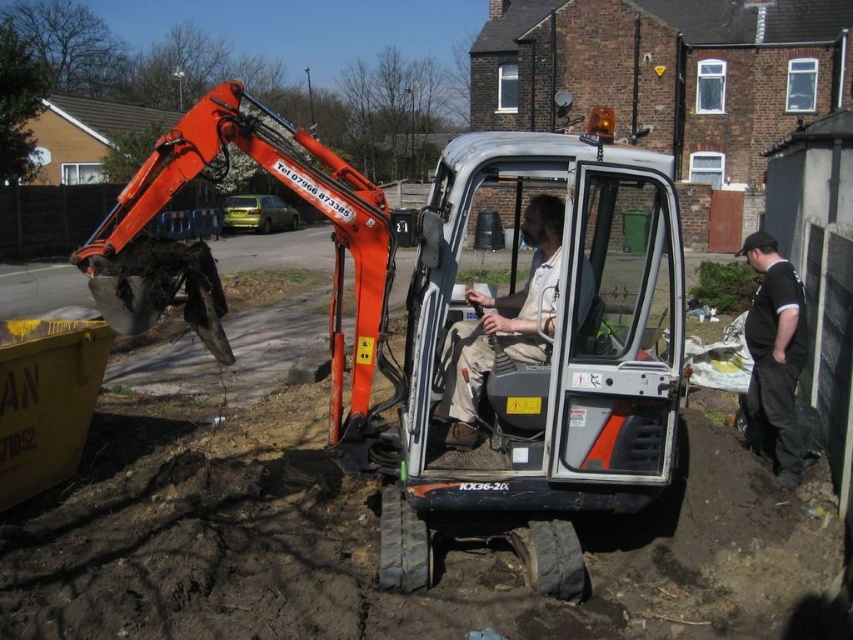
Question: Does camouflage fabric pants at center have a greater width compared to black cotton shirt at right?

Choices:
 (A) yes
 (B) no

Answer: (A)

Question: Which point is farther to the camera?

Choices:
 (A) camouflage fabric pants at center
 (B) black cotton shirt at right

Answer: (B)

Question: Is camouflage fabric pants at center above black cotton shirt at right?

Choices:
 (A) yes
 (B) no

Answer: (A)

Question: Can you confirm if camouflage fabric pants at center is positioned to the left of black cotton shirt at right?

Choices:
 (A) yes
 (B) no

Answer: (A)

Question: Which point appears farthest from the camera in this image?

Choices:
 (A) coord(788,349)
 (B) coord(519,332)

Answer: (A)